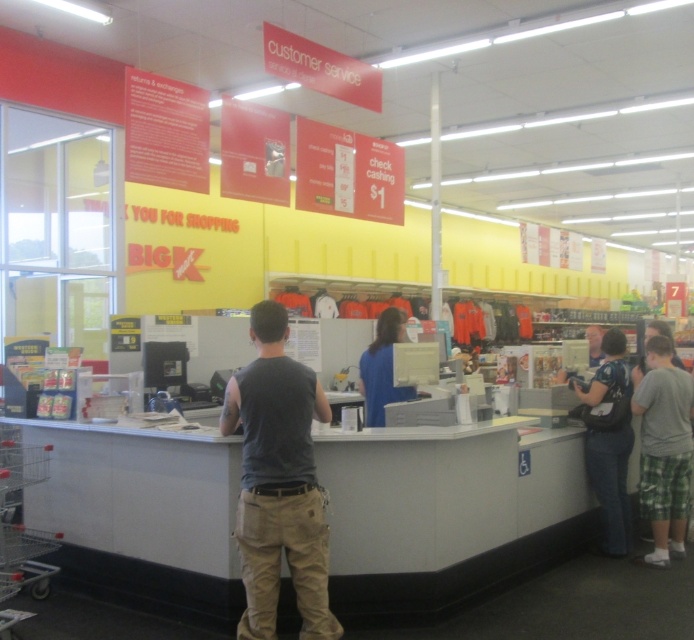
Who is lower down, gray cotton tank top at center or blue fabric shirt at center?

gray cotton tank top at center is lower down.

At what (x,y) coordinates should I click in order to perform the action: click on gray cotton tank top at center. Please return your answer as a coordinate pair (x, y). Image resolution: width=694 pixels, height=640 pixels. Looking at the image, I should click on (278, 481).

What do you see at coordinates (278, 481) in the screenshot? The image size is (694, 640). I see `gray cotton tank top at center` at bounding box center [278, 481].

Find the location of a particular element. The height and width of the screenshot is (640, 694). gray cotton tank top at center is located at coordinates (278, 481).

Does gray cotton tank top at center appear under denim pants at lower right?

No, gray cotton tank top at center is not below denim pants at lower right.

Is gray cotton tank top at center shorter than denim pants at lower right?

Correct, gray cotton tank top at center is not as tall as denim pants at lower right.

Is point (264, 417) less distant than point (609, 470)?

Yes, it is.

You are a GUI agent. You are given a task and a screenshot of the screen. Output one action in this format:
    pyautogui.click(x=<x>, y=<y>)
    Task: Click on the gray cotton tank top at center
    The image size is (694, 640).
    Given the screenshot: What is the action you would take?
    pyautogui.click(x=278, y=481)

Can you confirm if denim pants at lower right is smaller than blue fabric shirt at center?

Actually, denim pants at lower right might be larger than blue fabric shirt at center.

Who is higher up, denim pants at lower right or blue fabric shirt at center?

blue fabric shirt at center is higher up.

Between point (607, 492) and point (398, 320), which one is positioned in front?

Point (398, 320)

Locate an element on the screen. Image resolution: width=694 pixels, height=640 pixels. denim pants at lower right is located at coordinates (609, 440).